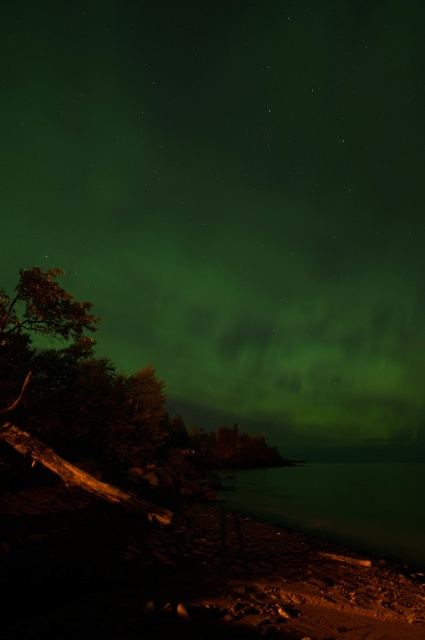
Question: Which point appears farthest from the camera in this image?

Choices:
 (A) (342, 532)
 (B) (25, 304)

Answer: (B)

Question: Among these objects, which one is nearest to the camera?

Choices:
 (A) green translucent water at lower center
 (B) green leafy tree at left

Answer: (A)

Question: Can you confirm if green leafy tree at left is positioned to the left of green translucent water at lower center?

Choices:
 (A) no
 (B) yes

Answer: (B)

Question: Which of the following is the closest to the observer?

Choices:
 (A) green leafy tree at left
 (B) green translucent water at lower center

Answer: (B)

Question: Can you confirm if green leafy tree at left is thinner than green translucent water at lower center?

Choices:
 (A) no
 (B) yes

Answer: (B)

Question: Is green leafy tree at left smaller than green translucent water at lower center?

Choices:
 (A) no
 (B) yes

Answer: (B)